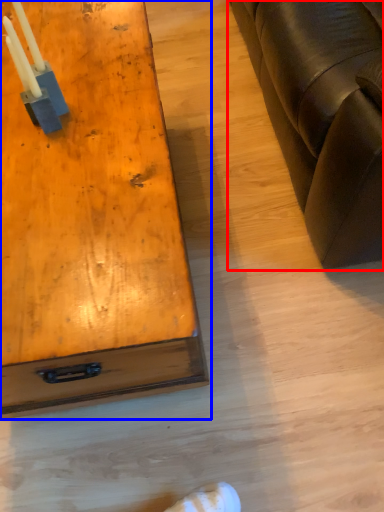
Question: Among these objects, which one is nearest to the camera, studio couch (highlighted by a red box) or table (highlighted by a blue box)?

Choices:
 (A) studio couch
 (B) table

Answer: (A)